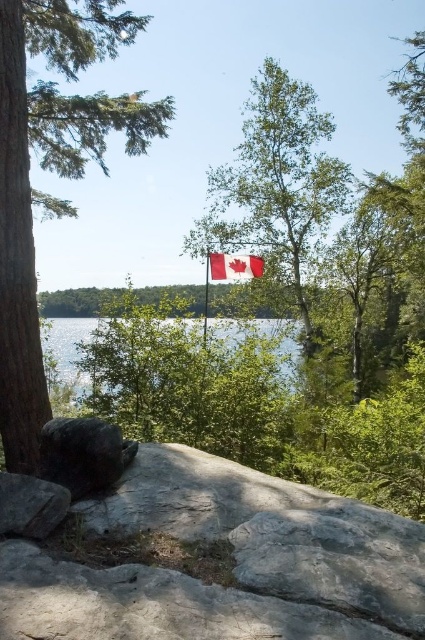
Question: Which point is farther to the camera?

Choices:
 (A) click(x=209, y=262)
 (B) click(x=3, y=433)

Answer: (A)

Question: Estimate the real-world distances between objects in this image. Which object is farther from the gray rough boulder at lower left?

Choices:
 (A) red fabric flag at center
 (B) transparent water at center

Answer: (A)

Question: Which object appears closest to the camera in this image?

Choices:
 (A) transparent water at center
 (B) red fabric flag at center
 (C) dark gray rock at lower left
 (D) rough gray rock at lower left

Answer: (D)

Question: Is green textured tree at left smaller than red fabric flag at center?

Choices:
 (A) yes
 (B) no

Answer: (B)

Question: Does green textured tree at left appear over dark gray rock at lower left?

Choices:
 (A) yes
 (B) no

Answer: (A)

Question: Is gray rough boulder at lower left to the left of transparent water at center from the viewer's perspective?

Choices:
 (A) no
 (B) yes

Answer: (B)